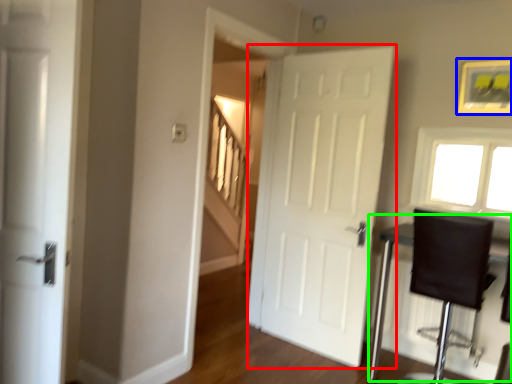
Question: Estimate the real-world distances between objects in this image. Which object is farther from door (highlighted by a red box), picture frame (highlighted by a blue box) or table (highlighted by a green box)?

Choices:
 (A) picture frame
 (B) table

Answer: (A)